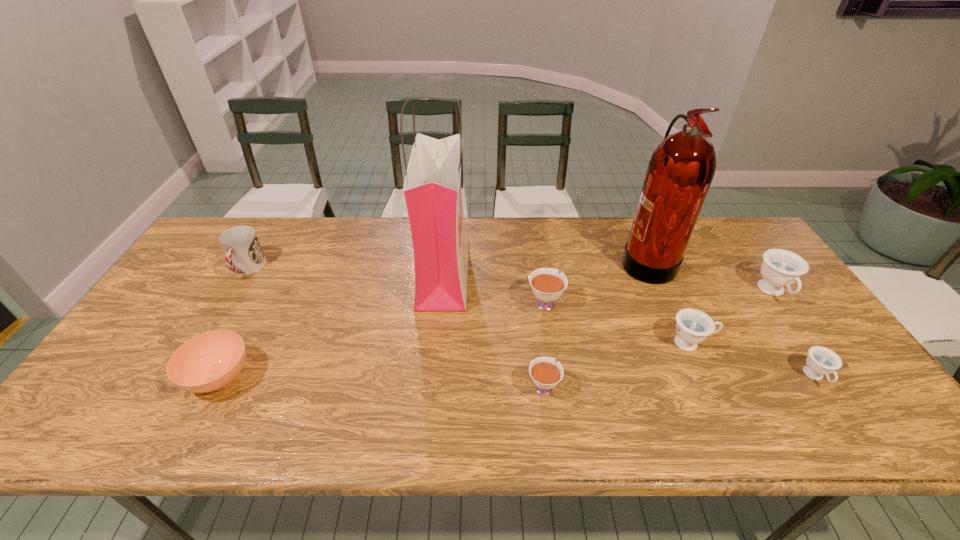
Where is `red fire extinguisher`? red fire extinguisher is located at coordinates (680, 171).

The width and height of the screenshot is (960, 540). What are the coordinates of `shopping bag` in the screenshot? It's located at (432, 189).

Find the location of a particular element. The image size is (960, 540). pink shopping bag is located at coordinates (432, 189).

Locate an element on the screen. This screenshot has height=540, width=960. red cup is located at coordinates (244, 255).

The width and height of the screenshot is (960, 540). Find the location of `the farthest blue teacup`. the farthest blue teacup is located at coordinates (781, 268).

The width and height of the screenshot is (960, 540). In order to click on the farther white teacup in this screenshot , I will do `click(547, 284)`.

You are a GUI agent. You are given a task and a screenshot of the screen. Output one action in this format:
    pyautogui.click(x=<x>, y=<y>)
    Task: Click on the third teacup from right to left
    
    Given the screenshot: What is the action you would take?
    click(x=693, y=326)

This screenshot has height=540, width=960. I want to click on the leftmost blue teacup, so click(693, 326).

The height and width of the screenshot is (540, 960). In order to click on peach soup bowl in this screenshot , I will do `click(209, 361)`.

The height and width of the screenshot is (540, 960). In order to click on the smaller white teacup in this screenshot , I will do `click(545, 372)`.